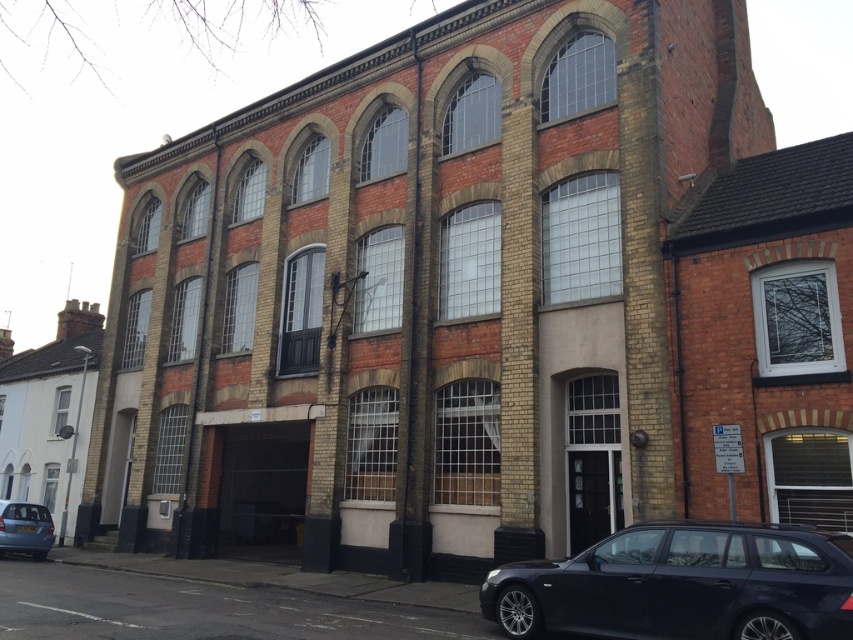
Who is higher up, matte black car at lower right or matte blue hatchback at lower left?

matte black car at lower right is higher up.

Between matte black car at lower right and matte blue hatchback at lower left, which one appears on the left side from the viewer's perspective?

Positioned to the left is matte blue hatchback at lower left.

Does point (689, 536) come behind point (10, 529)?

No, (689, 536) is in front of (10, 529).

The width and height of the screenshot is (853, 640). What are the coordinates of `matte black car at lower right` in the screenshot? It's located at (683, 584).